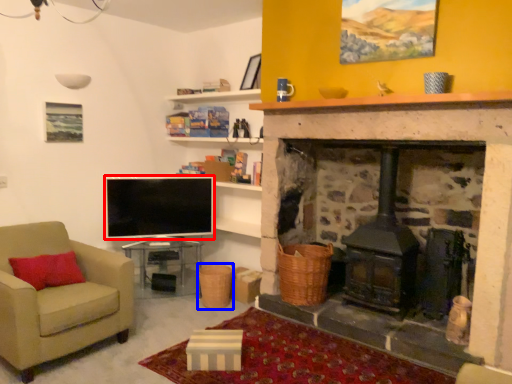
Question: Which object appears closest to the camera in this image, television (highlighted by a red box) or basket (highlighted by a blue box)?

Choices:
 (A) television
 (B) basket

Answer: (B)